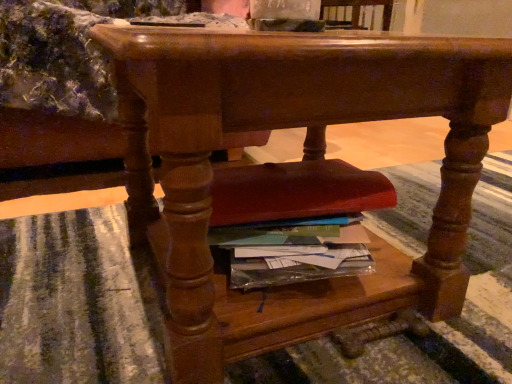
This screenshot has height=384, width=512. Describe the element at coordinates (59, 90) in the screenshot. I see `wooden chair at center` at that location.

The width and height of the screenshot is (512, 384). Identify the location of wooden chair at center. pos(59,90).

This screenshot has height=384, width=512. I want to click on wooden chair at center, so click(x=59, y=90).